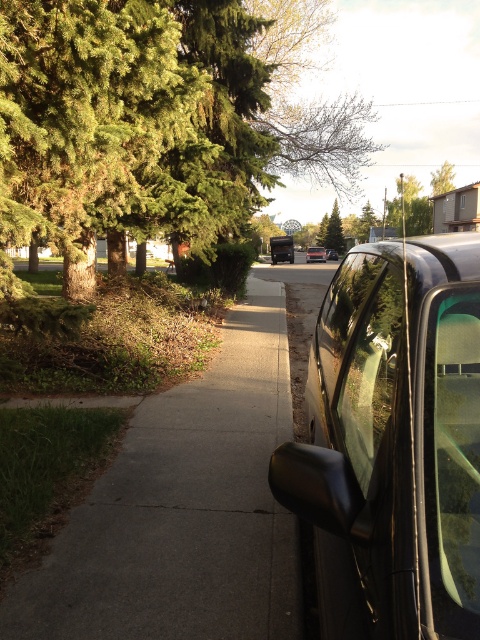
You are standing at the point with coordinates 0.5, 0.5 in the image. You want to walk to the gray concrete sidewalk at center. Which direction should you move? Please answer with either north, south, east, or west.

→ You should move south to reach the gray concrete sidewalk at center because the sidewalk is located at coordinates (183,509), which is south of your current position at (240,320).

You are standing at the camera position and want to walk to both points marked in the image. Which point should you reach first, the point at coordinate (292, 600) or the point at coordinate (311, 256)?

You should reach the point at coordinate (292, 600) first because it is closer to the camera than the point at coordinate (311, 256).